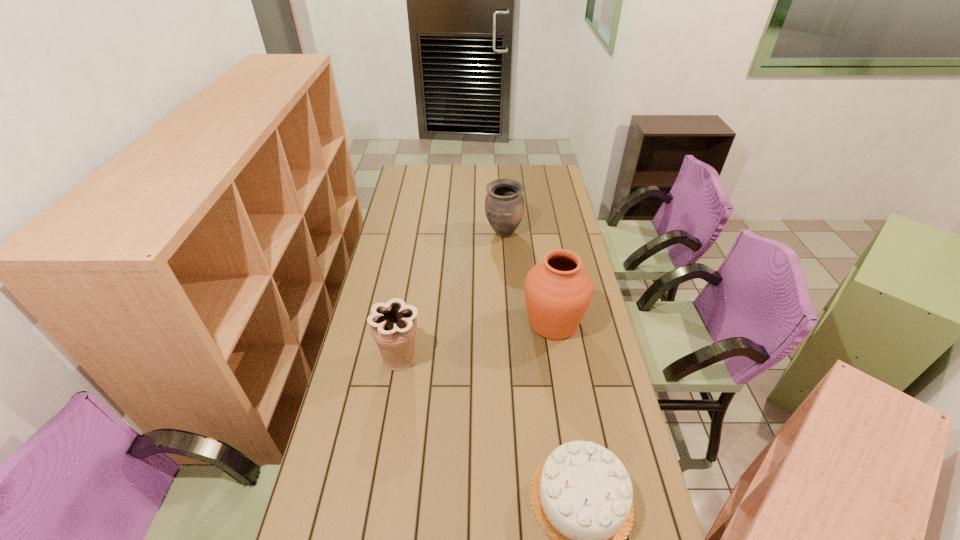
At what (x,y) coordinates should I click in order to perform the action: click on vacant space at the left edge. Please return your answer as a coordinate pair (x, y). The image size is (960, 540). Looking at the image, I should click on (363, 338).

Where is `blank area at the right edge`? Image resolution: width=960 pixels, height=540 pixels. blank area at the right edge is located at coordinates (598, 335).

In order to click on vacant space at the far left corner of the desktop in this screenshot , I will do `click(426, 174)`.

I want to click on free space at the far right corner of the desktop, so click(533, 177).

The image size is (960, 540). I want to click on empty space between the tallest urn and the leftmost object, so click(477, 340).

Locate an element on the screen. Image resolution: width=960 pixels, height=540 pixels. vacant area that lies between the farthest urn and the second shortest object is located at coordinates (452, 296).

Identify the location of vacant area between the farthest urn and the leftmost urn. The height and width of the screenshot is (540, 960). (452, 296).

Locate which object is the third closest to the nearest object. Please provide its 2D coordinates. Your answer should be formatted as a tuple, i.e. [(x, y)], where the tuple contains the x and y coordinates of a point satisfying the conditions above.

[(504, 204)]

Select which object appears as the second closest to the tallest object. Please provide its 2D coordinates. Your answer should be formatted as a tuple, i.e. [(x, y)], where the tuple contains the x and y coordinates of a point satisfying the conditions above.

[(504, 204)]

Image resolution: width=960 pixels, height=540 pixels. In order to click on urn that is the third closest to the birthday cake in this screenshot , I will do `click(504, 204)`.